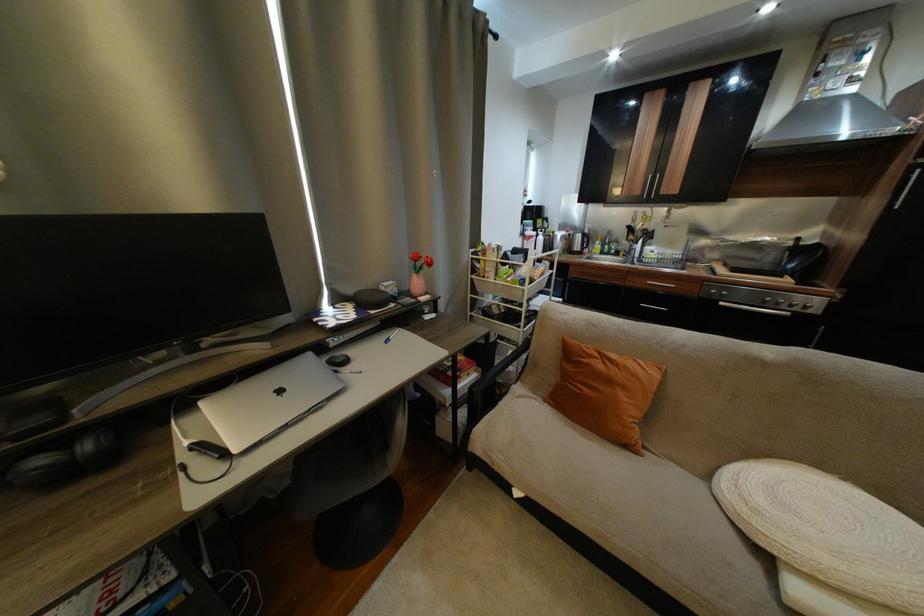
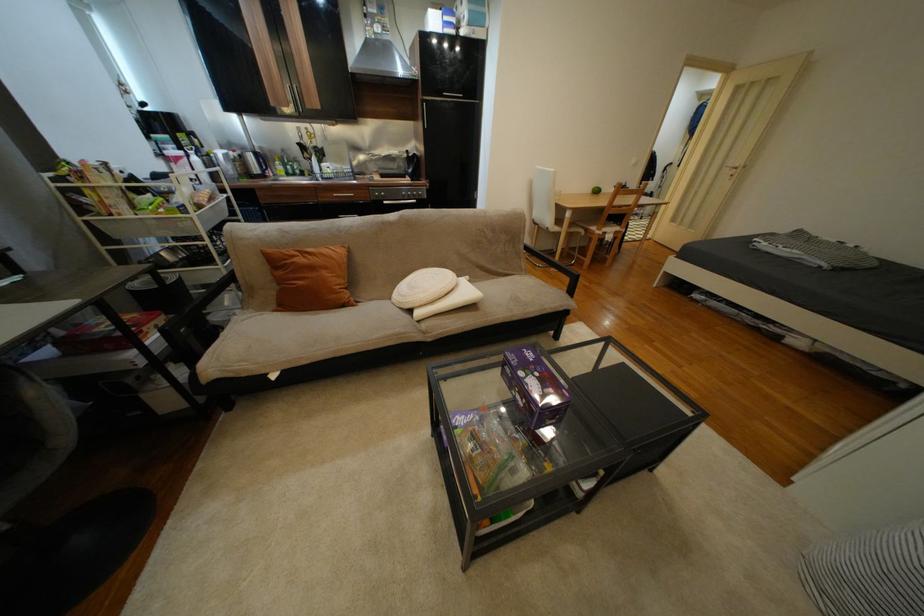
In the second image, find the point that corresponds to (640,284) in the first image.

(333, 200)